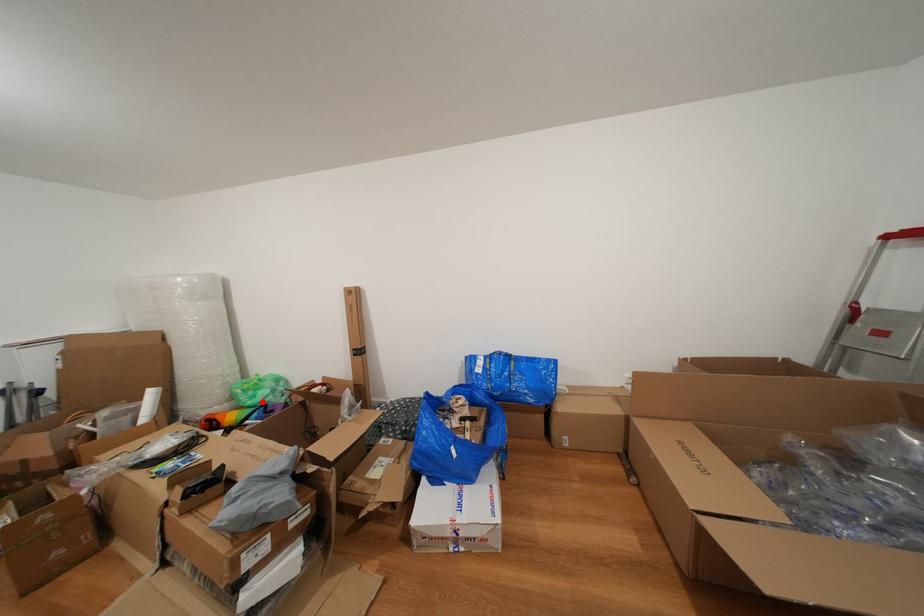
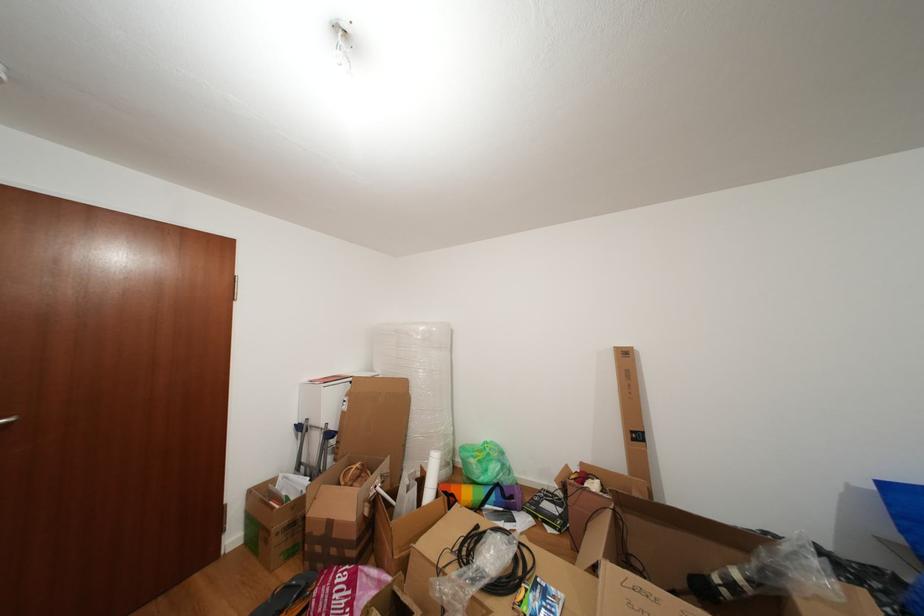
Locate, in the second image, the point that corresponds to the highlighted location in the first image.

(494, 476)